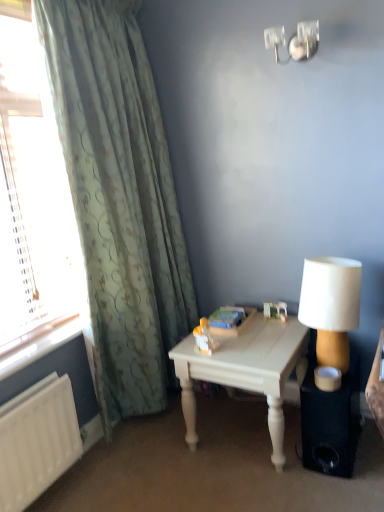
Where is `vacant space positioned to the left of white painted wood table at center`? The height and width of the screenshot is (512, 384). vacant space positioned to the left of white painted wood table at center is located at coordinates (157, 459).